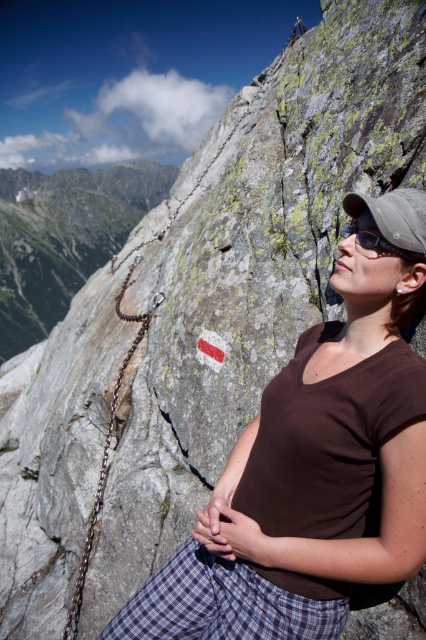
You are a photographer trying to capture the climber in the scene. The climber is wearing a brown matte shirt at center and black matte goggles at upper right. Based on their positions, which item is more to the left?

The black matte goggles at upper right are more to the left because the brown matte shirt at center is positioned on the right side of them.

You are a photographer trying to capture the climber in the scene. You notice the brown matte shirt at center and the black matte goggles at upper right. Which object should you focus on if you want to highlight something that takes up more visual space in the photo?

The brown matte shirt at center is larger in size than the black matte goggles at upper right, so focusing on the brown matte shirt at center would highlight the object that takes up more visual space in the photo.

You are a hiker assessing the safety of your gear. You notice the metallic chain at upper left and the brown matte shirt at center. Which object is wider?

The metallic chain at upper left is wider than the brown matte shirt at center.